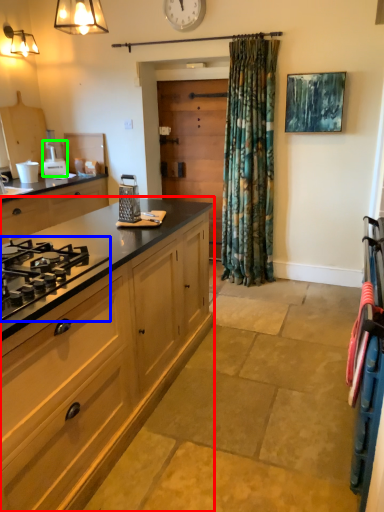
Question: Which object is positioned closest to cabinetry (highlighted by a red box)? Select from gas stove (highlighted by a blue box) and appliance (highlighted by a green box).

Choices:
 (A) gas stove
 (B) appliance

Answer: (A)